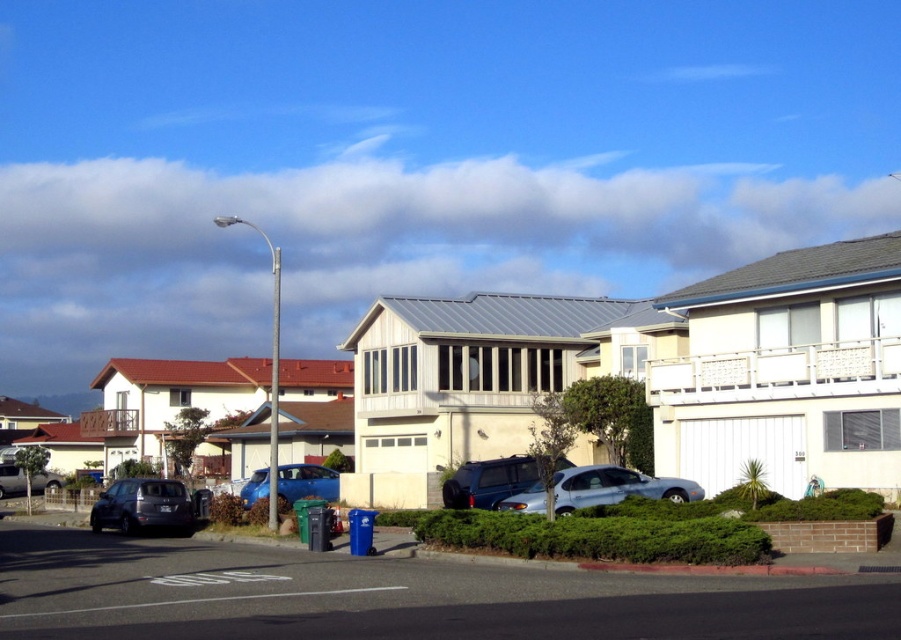
Is satin silver car at center positioned at the back of matte gray suv at lower left?

No, it is in front of matte gray suv at lower left.

Which is behind, point (580, 500) or point (134, 502)?

Point (134, 502)

Which is behind, point (560, 477) or point (135, 481)?

Positioned behind is point (135, 481).

Locate an element on the screen. The height and width of the screenshot is (640, 901). satin silver car at center is located at coordinates (615, 486).

Does matte gray suv at lower left appear over blue metallic car at center?

No, matte gray suv at lower left is not above blue metallic car at center.

What do you see at coordinates (149, 506) in the screenshot?
I see `matte gray suv at lower left` at bounding box center [149, 506].

Does point (143, 484) come in front of point (262, 496)?

Yes, it is in front of point (262, 496).

Find the location of a particular element. matte gray suv at lower left is located at coordinates (149, 506).

Can you confirm if satin silver car at center is positioned to the right of matte silver suv at lower left?

Yes, satin silver car at center is to the right of matte silver suv at lower left.

In order to click on satin silver car at center in this screenshot , I will do `click(615, 486)`.